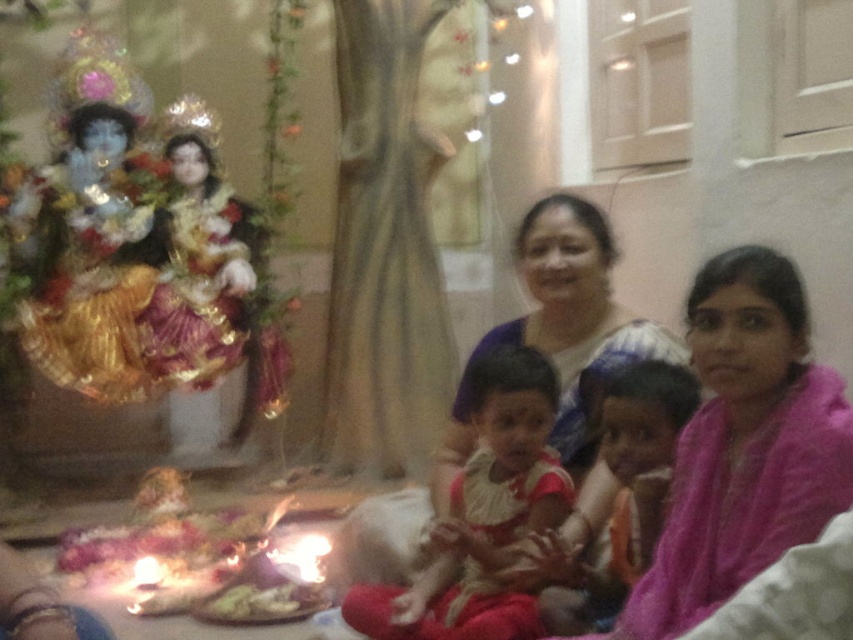
Based on the photo, between pink fabric at center and matte white dress at center, which one is positioned higher?

pink fabric at center is above.

Which is below, pink fabric at center or matte white dress at center?

matte white dress at center is below.

Is point (675, 620) in front of point (467, 502)?

Yes.

At what (x,y) coordinates should I click in order to perform the action: click on pink fabric at center. Please return your answer as a coordinate pair (x, y). The height and width of the screenshot is (640, 853). Looking at the image, I should click on (744, 444).

Does pink fabric at center lie behind matte pink dress at center?

No, pink fabric at center is closer to the viewer.

Does pink fabric at center have a larger size compared to matte pink dress at center?

Yes, pink fabric at center is bigger than matte pink dress at center.

Is point (706, 429) in front of point (567, 563)?

Yes, it is.

In order to click on pink fabric at center in this screenshot , I will do `click(744, 444)`.

Can you confirm if matte white dress at center is thinner than matte pink dress at center?

No.

Measure the distance from matte white dress at center to matte pink dress at center.

matte white dress at center and matte pink dress at center are 8.19 inches apart from each other.

Locate an element on the screen. matte white dress at center is located at coordinates (482, 515).

This screenshot has width=853, height=640. What are the coordinates of `matte white dress at center` in the screenshot? It's located at (482, 515).